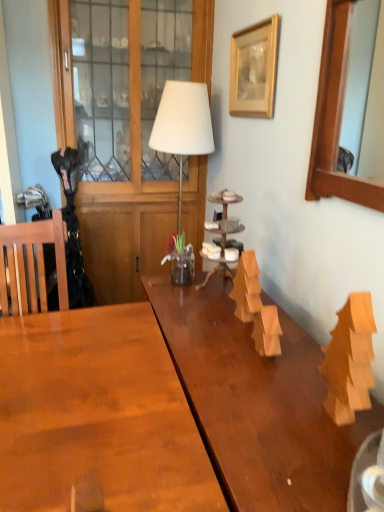
What do you see at coordinates (183, 123) in the screenshot?
I see `white matte table lamp at center` at bounding box center [183, 123].

The image size is (384, 512). Identify the location of wooden picture frame at upper center, which appears as the 2th picture frame when viewed from the right. (254, 69).

Find the location of a particular element. This screenshot has height=512, width=384. white matte table lamp at center is located at coordinates (183, 123).

Is wooden picture frame at upper center, the second picture frame in the front-to-back sequence, oriented towards white matte table lamp at center?

No, wooden picture frame at upper center, the second picture frame in the front-to-back sequence, is not aimed at white matte table lamp at center.

Is wooden picture frame at upper center, marked as the first picture frame in a back-to-front arrangement, taller or shorter than white matte table lamp at center?

Considering their sizes, wooden picture frame at upper center, marked as the first picture frame in a back-to-front arrangement, has less height than white matte table lamp at center.

In the scene shown: Could you measure the distance between wooden picture frame at upper center, which appears as the 2th picture frame when viewed from the right, and white matte table lamp at center?

14.55 inches.

Can you tell me how much wooden picture frame at upper center, marked as the first picture frame in a back-to-front arrangement, and white matte table lamp at center differ in facing direction?

The facing directions of wooden picture frame at upper center, marked as the first picture frame in a back-to-front arrangement, and white matte table lamp at center are 93.7 degrees apart.

From a real-world perspective, starting from the white matte table lamp at center, which picture frame is the 1st one vertically above it? Please provide its 2D coordinates.

[(335, 118)]

Is wooden mirror at upper right, arranged as the 1th picture frame when viewed from the front, positioned far away from white matte table lamp at center?

They are positioned close to each other.

Is wooden mirror at upper right, arranged as the 1th picture frame when viewed from the front, closer to camera compared to white matte table lamp at center?

Yes.

How distant is wooden mirror at upper right, the 2th picture frame when ordered from left to right, from white matte table lamp at center?

The distance of wooden mirror at upper right, the 2th picture frame when ordered from left to right, from white matte table lamp at center is 94.68 centimeters.

Considering the relative sizes of white matte table lamp at center and wooden cabinet at left in the image provided, is white matte table lamp at center taller than wooden cabinet at left?

Incorrect, the height of white matte table lamp at center is not larger of that of wooden cabinet at left.

You are a GUI agent. You are given a task and a screenshot of the screen. Output one action in this format:
    pyautogui.click(x=<x>, y=<y>)
    Task: Click on the dresser that appears above the white matte table lamp at center (from the image's perspective)
    Image resolution: width=384 pixels, height=512 pixels.
    Given the screenshot: What is the action you would take?
    pyautogui.click(x=127, y=202)

Is there a large distance between white matte table lamp at center and wooden cabinet at left?

Actually, white matte table lamp at center and wooden cabinet at left are a little close together.

The image size is (384, 512). I want to click on picture frame located behind the wooden mirror at upper right, the 1th picture frame when ordered from right to left, so click(x=254, y=69).

Which of these two, wooden mirror at upper right, the 2th picture frame when ordered from left to right, or wooden picture frame at upper center, which is the first picture frame in left-to-right order, is wider?

wooden mirror at upper right, the 2th picture frame when ordered from left to right, is wider.

From the image's perspective, is wooden mirror at upper right, the 2th picture frame when ordered from left to right, under wooden picture frame at upper center, which appears as the 2th picture frame when viewed from the right?

→ Yes, from the image's perspective, wooden mirror at upper right, the 2th picture frame when ordered from left to right, is below wooden picture frame at upper center, which appears as the 2th picture frame when viewed from the right.

Is wooden mirror at upper right, the 1th picture frame when ordered from right to left, taller than wooden picture frame at upper center, which is the first picture frame in left-to-right order?

Yes.

Considering the sizes of wooden picture frame at upper center, which is the first picture frame in left-to-right order, and wooden cabinet at left in the image, is wooden picture frame at upper center, which is the first picture frame in left-to-right order, taller or shorter than wooden cabinet at left?

In the image, wooden picture frame at upper center, which is the first picture frame in left-to-right order, appears to be shorter than wooden cabinet at left.

What's the angular difference between wooden picture frame at upper center, marked as the first picture frame in a back-to-front arrangement, and wooden cabinet at left's facing directions?

90.7 degrees separate the facing orientations of wooden picture frame at upper center, marked as the first picture frame in a back-to-front arrangement, and wooden cabinet at left.

This screenshot has height=512, width=384. Find the location of `dresser located behind the wooden picture frame at upper center, marked as the first picture frame in a back-to-front arrangement`. dresser located behind the wooden picture frame at upper center, marked as the first picture frame in a back-to-front arrangement is located at coordinates pos(127,202).

Which object is positioned more to the left, wooden picture frame at upper center, which appears as the 2th picture frame when viewed from the right, or wooden cabinet at left?

From the viewer's perspective, wooden cabinet at left appears more on the left side.

Considering the sizes of objects wooden cabinet at left and wooden mirror at upper right, the 2th picture frame when ordered from left to right, in the image provided, who is thinner, wooden cabinet at left or wooden mirror at upper right, the 2th picture frame when ordered from left to right,?

wooden mirror at upper right, the 2th picture frame when ordered from left to right, is thinner.

From a real-world perspective, is wooden cabinet at left over wooden mirror at upper right, which is counted as the 2th picture frame, starting from the back?

No, from a real-world perspective, wooden cabinet at left is not on top of wooden mirror at upper right, which is counted as the 2th picture frame, starting from the back.

Looking at this image, is wooden cabinet at left bigger than wooden mirror at upper right, which is counted as the 2th picture frame, starting from the back?

Yes, wooden cabinet at left is bigger than wooden mirror at upper right, which is counted as the 2th picture frame, starting from the back.

Is wooden mirror at upper right, arranged as the 1th picture frame when viewed from the front, facing away from wooden cabinet at left?

wooden mirror at upper right, arranged as the 1th picture frame when viewed from the front, does not have its back to wooden cabinet at left.

Is wooden mirror at upper right, the 2th picture frame when ordered from left to right, beside wooden cabinet at left?

No, wooden mirror at upper right, the 2th picture frame when ordered from left to right, is not with wooden cabinet at left.

The height and width of the screenshot is (512, 384). What are the coordinates of `dresser on the left of wooden mirror at upper right, the 1th picture frame when ordered from right to left` in the screenshot? It's located at coord(127,202).

In the image, there is a wooden picture frame at upper center, which appears as the 2th picture frame when viewed from the right. Where is `table lamp below it (from the image's perspective)`? table lamp below it (from the image's perspective) is located at coordinates (183, 123).

Identify the location of table lamp below the wooden mirror at upper right, the 1th picture frame when ordered from right to left (from a real-world perspective). coord(183,123).

From the image, which object appears to be nearer to wooden cabinet at left, white matte table lamp at center or wooden picture frame at upper center, which appears as the 2th picture frame when viewed from the right?

white matte table lamp at center is closer to wooden cabinet at left.

From the image, which object appears to be nearer to wooden cabinet at left, wooden picture frame at upper center, which is the first picture frame in left-to-right order, or wooden mirror at upper right, the 1th picture frame when ordered from right to left?

Based on the image, wooden picture frame at upper center, which is the first picture frame in left-to-right order, appears to be nearer to wooden cabinet at left.

Estimate the real-world distances between objects in this image. Which object is closer to wooden cabinet at left, white matte table lamp at center or wooden mirror at upper right, arranged as the 1th picture frame when viewed from the front?

white matte table lamp at center lies closer to wooden cabinet at left than the other object.

Estimate the real-world distances between objects in this image. Which object is further from wooden mirror at upper right, arranged as the 1th picture frame when viewed from the front, white matte table lamp at center or wooden cabinet at left?

The object further to wooden mirror at upper right, arranged as the 1th picture frame when viewed from the front, is wooden cabinet at left.

Estimate the real-world distances between objects in this image. Which object is closer to wooden picture frame at upper center, which is the first picture frame in left-to-right order, white matte table lamp at center or wooden cabinet at left?

Among the two, white matte table lamp at center is located nearer to wooden picture frame at upper center, which is the first picture frame in left-to-right order.

From the image, which object appears to be nearer to wooden mirror at upper right, the 2th picture frame when ordered from left to right, wooden picture frame at upper center, marked as the first picture frame in a back-to-front arrangement, or white matte table lamp at center?

Based on the image, wooden picture frame at upper center, marked as the first picture frame in a back-to-front arrangement, appears to be nearer to wooden mirror at upper right, the 2th picture frame when ordered from left to right.

Consider the image. From the image, which object appears to be farther from wooden cabinet at left, wooden mirror at upper right, arranged as the 1th picture frame when viewed from the front, or white matte table lamp at center?

wooden mirror at upper right, arranged as the 1th picture frame when viewed from the front, lies further to wooden cabinet at left than the other object.

Based on the photo, from the image, which object appears to be nearer to wooden picture frame at upper center, the second picture frame in the front-to-back sequence, wooden cabinet at left or wooden mirror at upper right, the 2th picture frame when ordered from left to right?

wooden mirror at upper right, the 2th picture frame when ordered from left to right.

Locate an element on the screen. Image resolution: width=384 pixels, height=512 pixels. table lamp between wooden cabinet at left and wooden picture frame at upper center, which appears as the 2th picture frame when viewed from the right is located at coordinates (183, 123).

Find the location of a particular element. The width and height of the screenshot is (384, 512). picture frame between wooden mirror at upper right, the 2th picture frame when ordered from left to right, and white matte table lamp at center, along the z-axis is located at coordinates (254, 69).

Where is `table lamp between wooden mirror at upper right, arranged as the 1th picture frame when viewed from the front, and wooden cabinet at left, along the z-axis`? table lamp between wooden mirror at upper right, arranged as the 1th picture frame when viewed from the front, and wooden cabinet at left, along the z-axis is located at coordinates 183,123.

Find the location of a particular element. The image size is (384, 512). picture frame between wooden mirror at upper right, which is counted as the 2th picture frame, starting from the back, and wooden cabinet at left in the front-back direction is located at coordinates (254, 69).